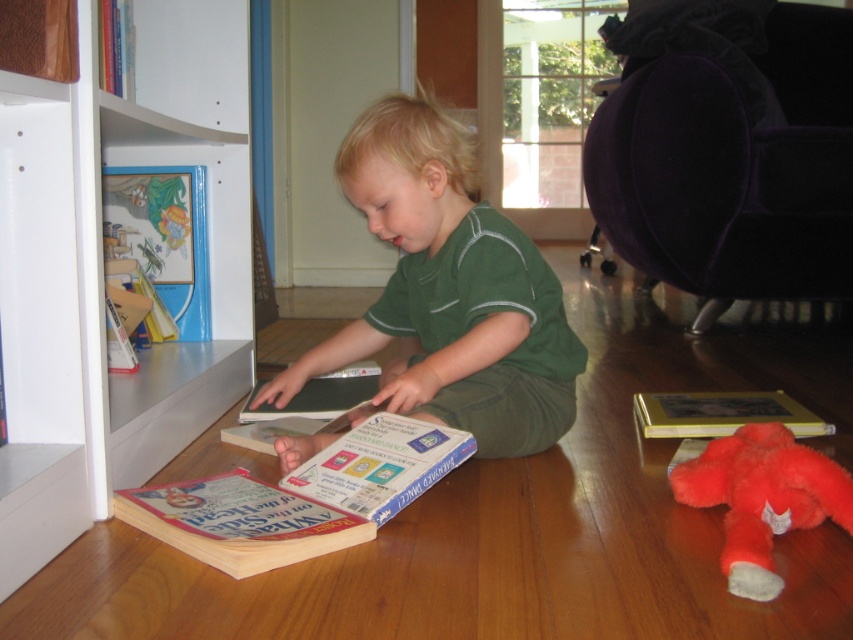
Question: Does green matte shirt at center have a larger size compared to fluffy red stuffed animal at lower right?

Choices:
 (A) yes
 (B) no

Answer: (A)

Question: Is hardcover book at lower center further to the viewer compared to fluffy red stuffed animal at lower right?

Choices:
 (A) no
 (B) yes

Answer: (B)

Question: Which object appears closest to the camera in this image?

Choices:
 (A) hardcover book at lower center
 (B) white matte bookshelf at lower left
 (C) green matte shirt at center

Answer: (B)

Question: Which point is closer to the camera?

Choices:
 (A) (489, 454)
 (B) (335, 522)
 (C) (99, 58)
 (D) (64, 230)

Answer: (D)

Question: Can you confirm if green matte shirt at center is positioned above hardcover book at center?

Choices:
 (A) no
 (B) yes

Answer: (B)

Question: Which point is closer to the camera taking this photo?

Choices:
 (A) (799, 504)
 (B) (660, 432)

Answer: (A)